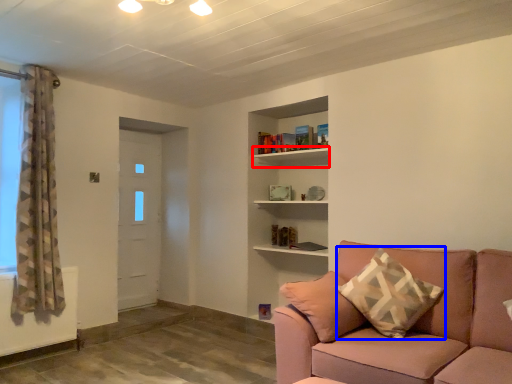
Question: Which object appears closest to the camera in this image, shelf (highlighted by a red box) or pillow (highlighted by a blue box)?

Choices:
 (A) shelf
 (B) pillow

Answer: (B)